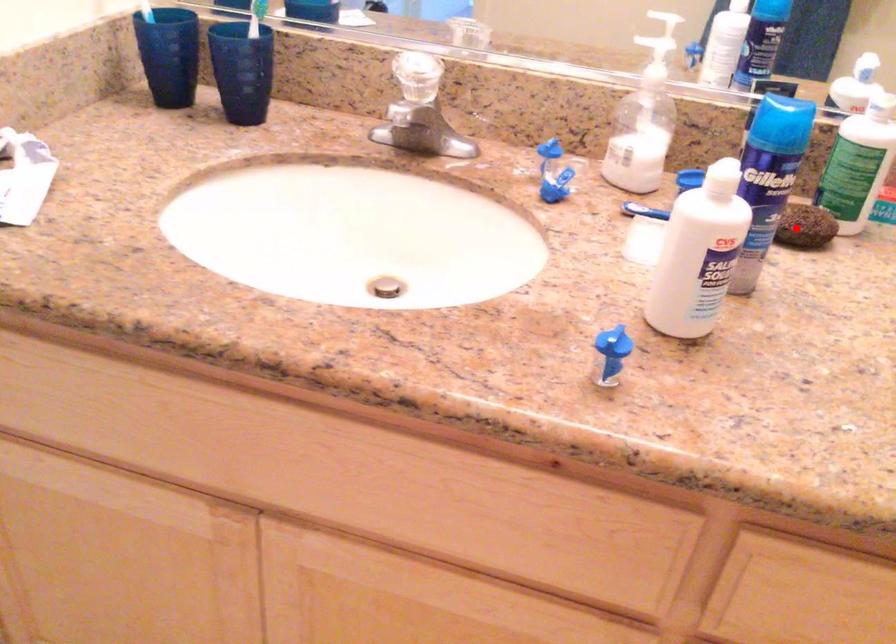
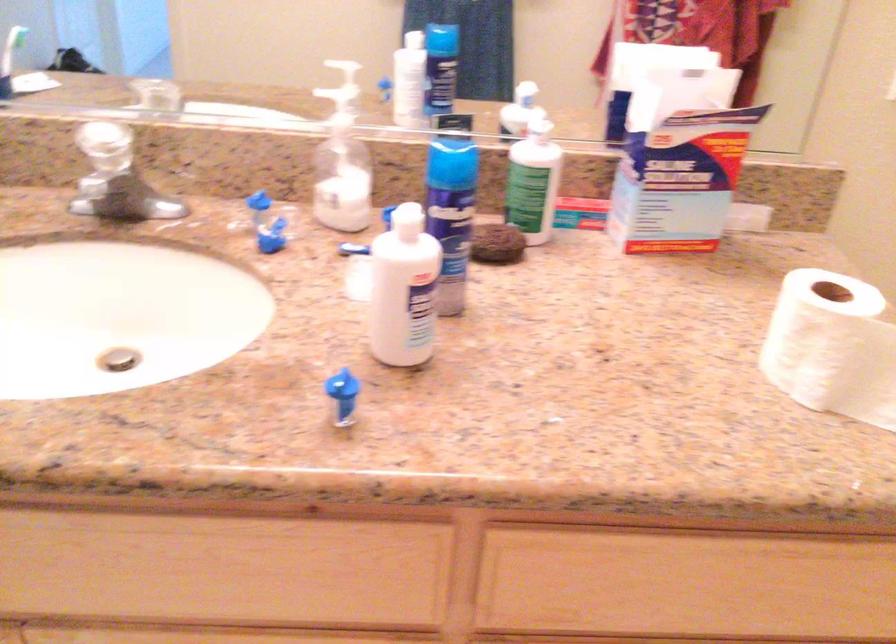
The point at the highlighted location is marked in the first image. Where is the corresponding point in the second image?

(496, 243)